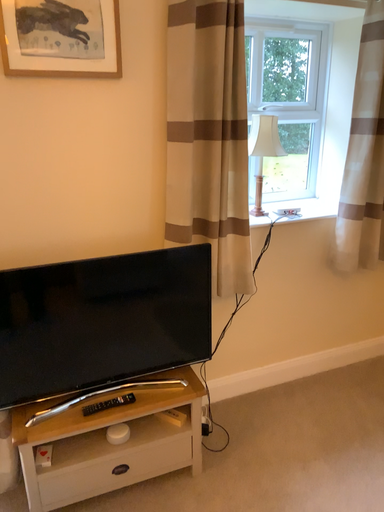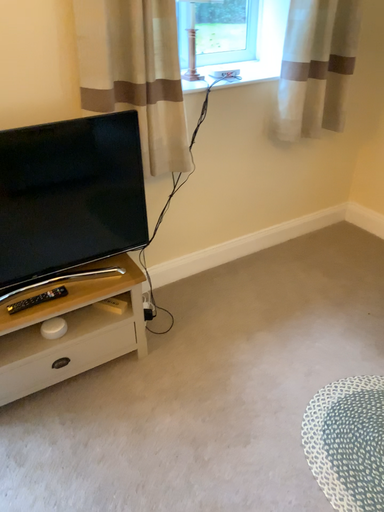
Question: Which way did the camera rotate in the video?

Choices:
 (A) rotated downward
 (B) rotated upward

Answer: (A)